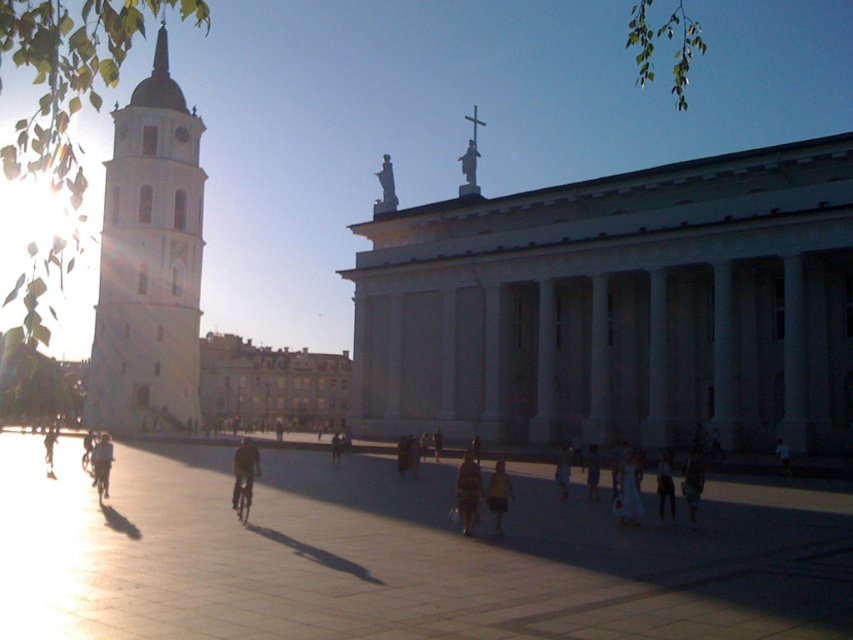
Question: Can you confirm if dark blue fabric dress at lower center is smaller than dark brown leather jacket at center?

Choices:
 (A) no
 (B) yes

Answer: (B)

Question: Which is nearer to the dark blue fabric dress at lower center?

Choices:
 (A) light brown leather jacket at lower left
 (B) striped fabric dress at center

Answer: (B)

Question: Among these objects, which one is nearest to the camera?

Choices:
 (A) yellow fabric dress at center
 (B) white stone tower at left
 (C) light brown leather jacket at center
 (D) dark brown leather jacket at center

Answer: (A)

Question: Which object is closer to the camera taking this photo?

Choices:
 (A) dark brown leather jacket at lower left
 (B) dark blue jeans at lower right
 (C) dark blue fabric bicycle at center
 (D) yellow fabric dress at center

Answer: (D)

Question: Is dark blue jeans at lower right bigger than dark brown leather jacket at lower left?

Choices:
 (A) yes
 (B) no

Answer: (B)

Question: Can you confirm if striped fabric dress at center is positioned below dark blue fabric dress at lower center?

Choices:
 (A) no
 (B) yes

Answer: (A)